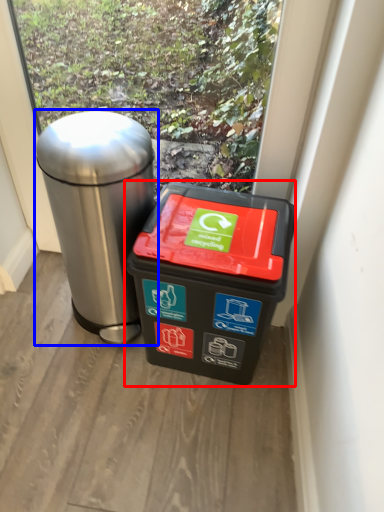
Question: Among these objects, which one is nearest to the camera, waste container (highlighted by a red box) or waste container (highlighted by a blue box)?

Choices:
 (A) waste container
 (B) waste container

Answer: (B)